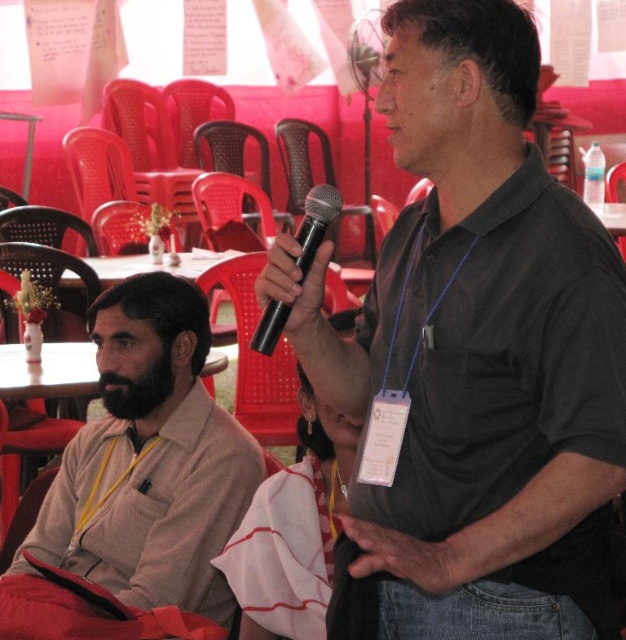
From the picture: You are a photographer standing at the back of the room. You want to take a photo of the black matte shirt at center. Where should you aim your camera to capture the subject?

The black matte shirt at center is located at point 0.558 on the x axis and 0.760 on the y axis, so you should aim your camera at those coordinates to capture the subject.

You are attending a meeting and want to identify who is speaking. Based on the image, which object is closer to you between the black matte shirt at center and the black matte microphone at center?

The black matte shirt at center is positioned under the black matte microphone at center, meaning the microphone is closer to you.

You are planning to take a photo of the two seated individuals, the black matte shirt at center and the beige sweater at left. To ensure both are fully visible in the frame, which person should you position closer to the camera?

The black matte shirt at center is much taller than the beige sweater at left, so positioning the beige sweater at left closer to the camera will help ensure both are fully visible in the frame.